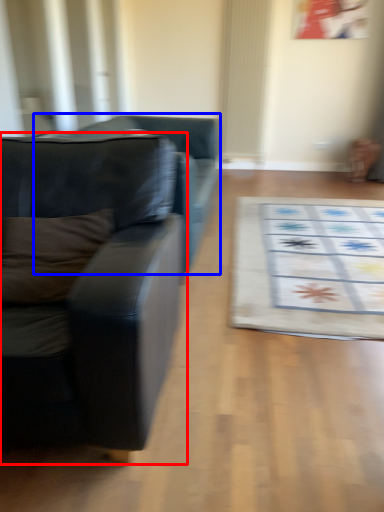
Question: Which object appears closest to the camera in this image, studio couch (highlighted by a red box) or studio couch (highlighted by a blue box)?

Choices:
 (A) studio couch
 (B) studio couch

Answer: (A)